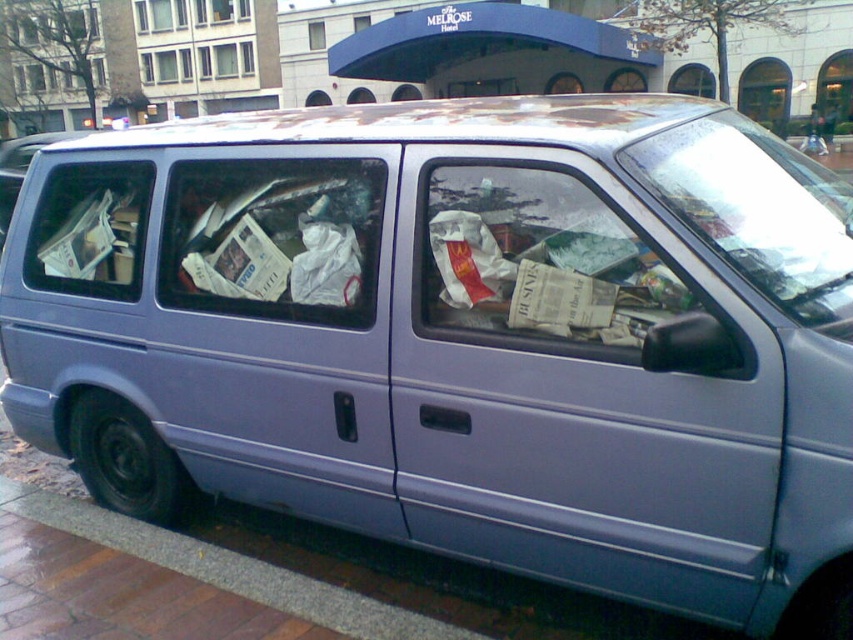
Question: Is gray concrete curb at lower left above matte plastic van at center?

Choices:
 (A) yes
 (B) no

Answer: (B)

Question: Among these points, which one is nearest to the camera?

Choices:
 (A) (10, 188)
 (B) (148, 545)

Answer: (B)

Question: Is gray concrete curb at lower left positioned in front of matte plastic van at center?

Choices:
 (A) no
 (B) yes

Answer: (B)

Question: Can you confirm if gray concrete curb at lower left is positioned to the right of matte plastic van at center?

Choices:
 (A) no
 (B) yes

Answer: (B)